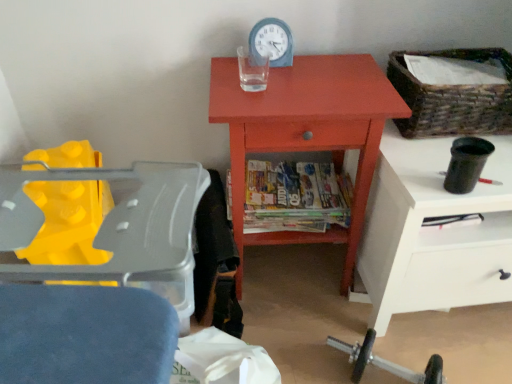
Find the location of a particular element. vacant location below matte orange cabinet at center (from a real-world perspective) is located at coordinates (292, 271).